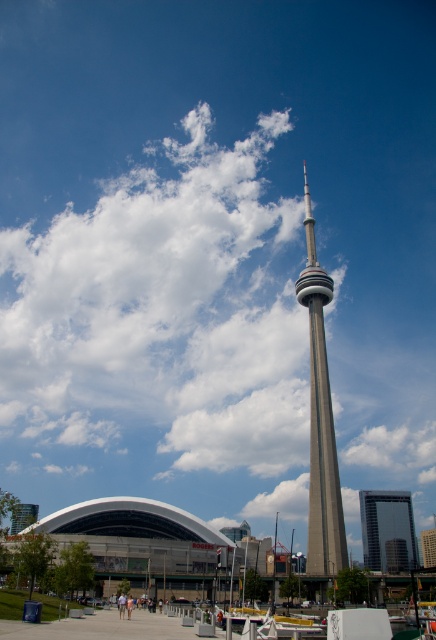
You are a photographer planning to capture the CN Tower and the Rogers Centre in a single shot. You notice the white fluffy cloud at upper center and the glassy reflective skyscraper at center. Which object is positioned higher in the sky?

The white fluffy cloud at upper center is positioned higher in the sky than the glassy reflective skyscraper at center.

You are a bird flying over Toronto and want to land on the silver metallic cn tower at center. However, there is a white fluffy cloud at upper center blocking your path. Is the cloud above or below the tower?

The white fluffy cloud at upper center is above the silver metallic cn tower at center, so the cloud is blocking the path from above.

You are standing at the point marked by coordinates point (x=320, y=420) in the image. What landmark are you facing?

You are facing the silver metallic CN Tower at center, as the point (x=320, y=420) represents its location in the image.